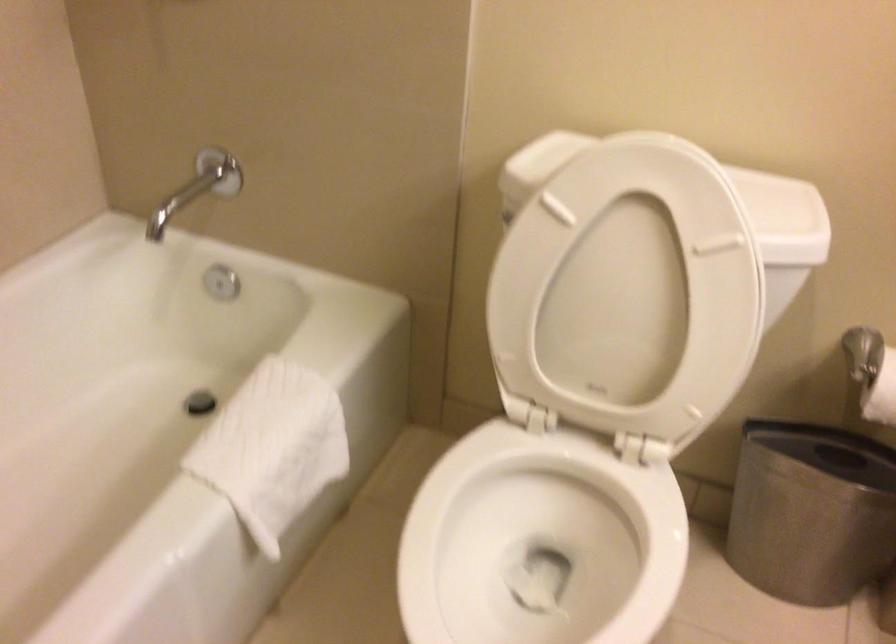
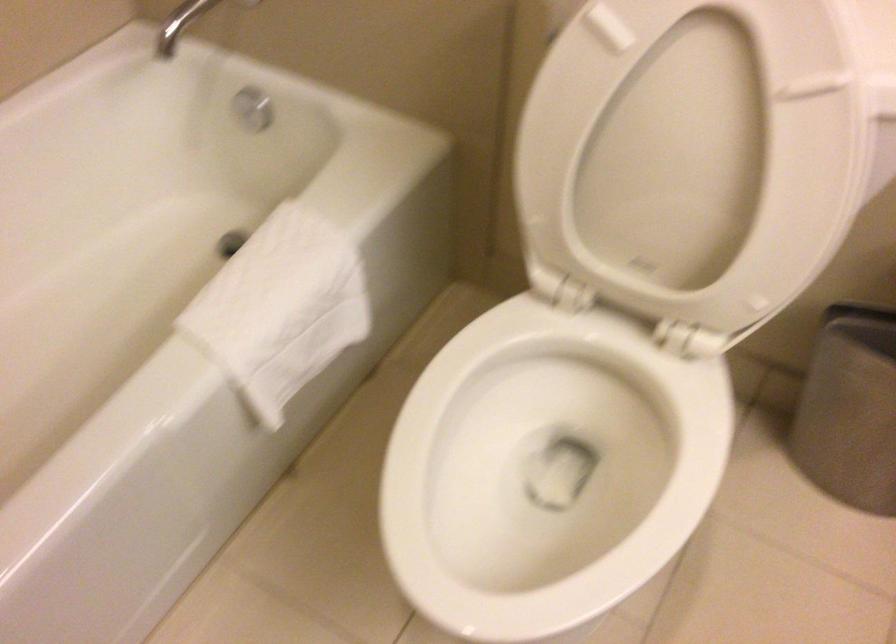
Locate, in the second image, the point that corresponds to the point at 222,281 in the first image.

(252, 108)